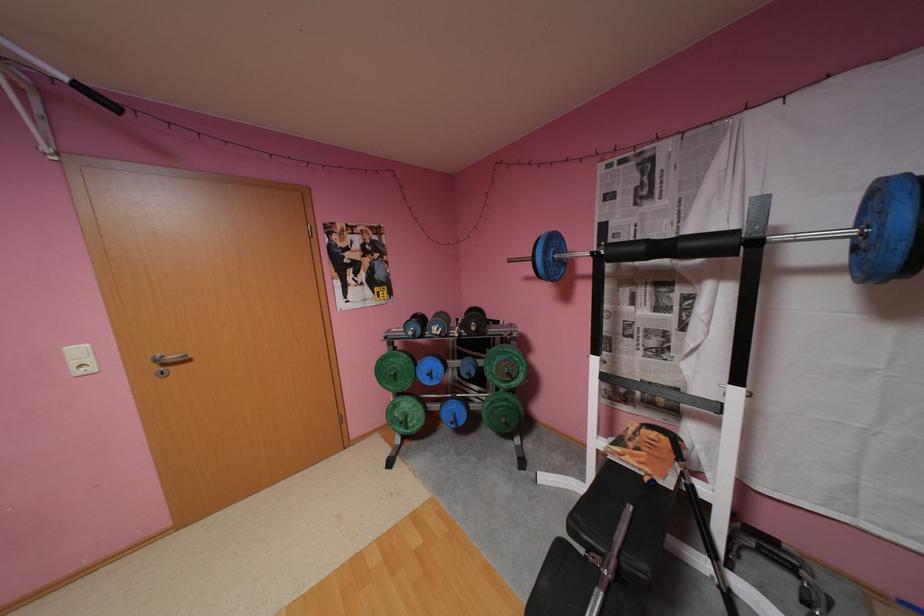
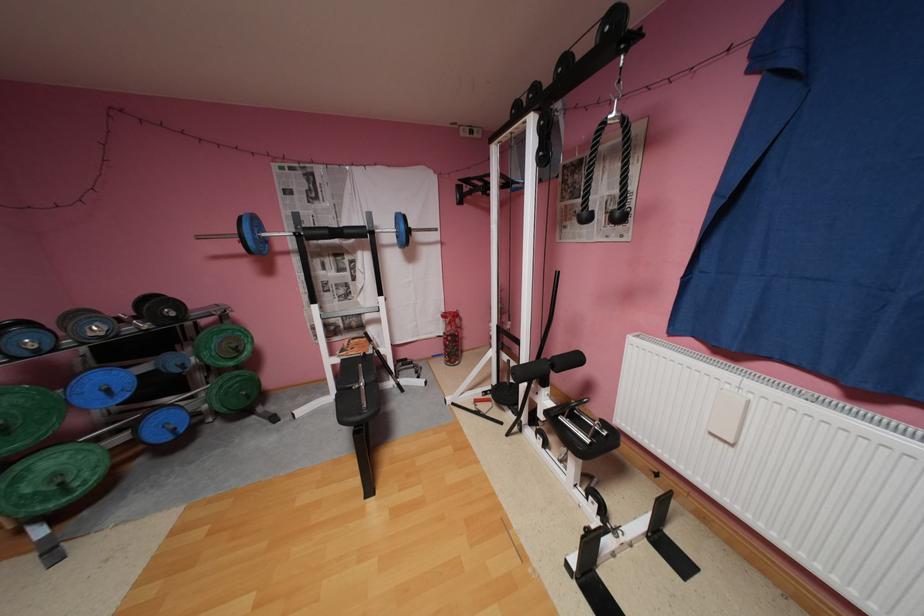
Question: The camera is either moving clockwise (left) or counter-clockwise (right) around the object. The first image is from the beginning of the video and the second image is from the end. Is the camera moving left or right when shooting the video?

Choices:
 (A) Left
 (B) Right

Answer: (A)